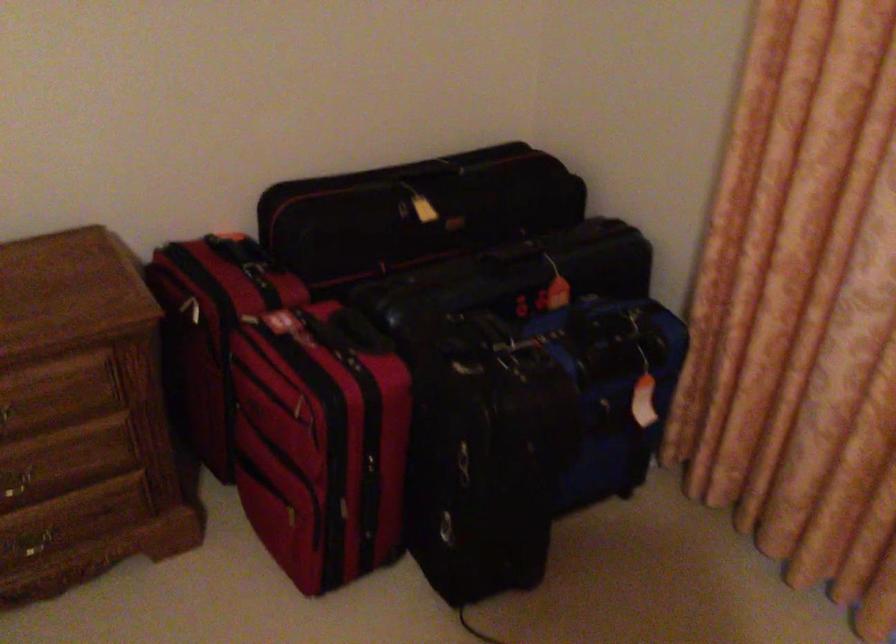
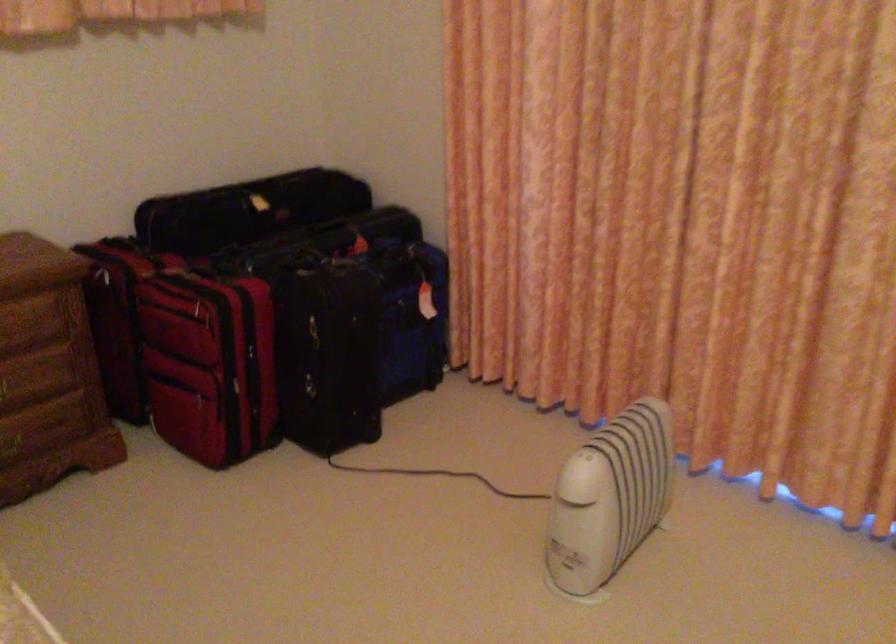
Question: Which direction would the cameraman need to move to produce the second image? Reply with the corresponding letter.

Choices:
 (A) Left
 (B) Right
 (C) Forward
 (D) Backward

Answer: (D)